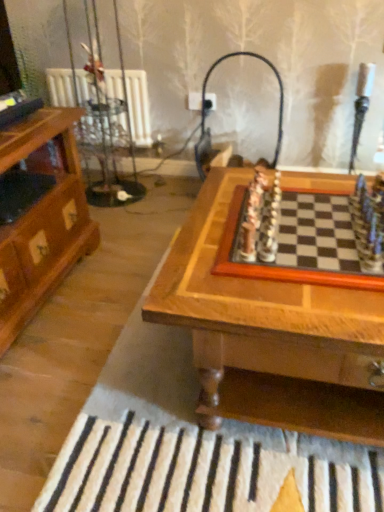
The image size is (384, 512). I want to click on free spot above wooden chessboard at center (from a real-world perspective), so click(315, 227).